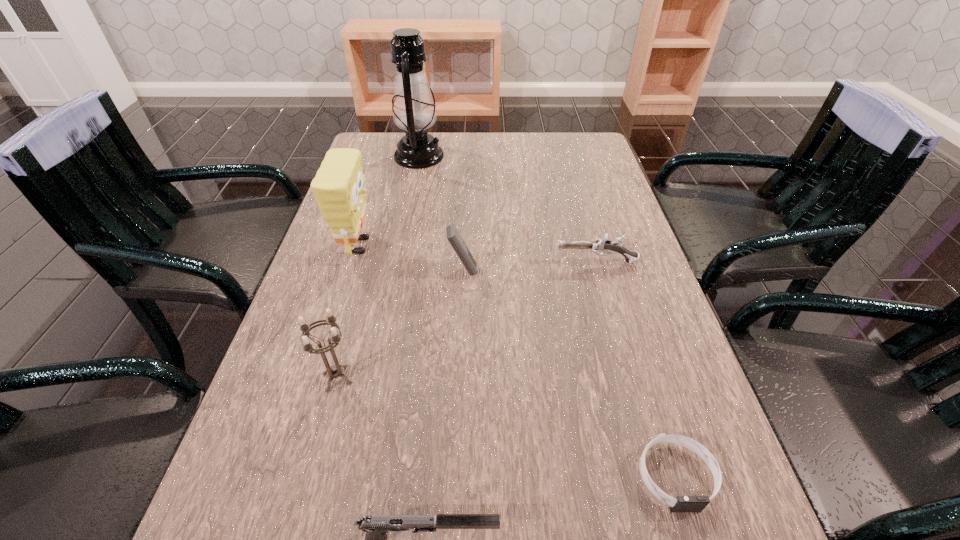
The height and width of the screenshot is (540, 960). I want to click on gun located in the right edge section of the desktop, so click(603, 245).

Image resolution: width=960 pixels, height=540 pixels. I want to click on wristband located in the right edge section of the desktop, so click(x=682, y=503).

I want to click on object that is positioned at the far left corner, so click(413, 108).

The image size is (960, 540). In order to click on vacant space at the far edge of the desktop in this screenshot , I will do `click(465, 152)`.

Where is `vacant region at the left edge of the desktop`? vacant region at the left edge of the desktop is located at coordinates (364, 312).

Identify the location of vacant space at the right edge of the desktop. (646, 377).

Image resolution: width=960 pixels, height=540 pixels. Find the location of `free point at the far left corner`. free point at the far left corner is located at coordinates (365, 153).

At what (x,y) coordinates should I click in order to perform the action: click on unoccupied position between the oil lamp and the fifth farthest object. Please return your answer as a coordinate pair (x, y). The height and width of the screenshot is (540, 960). Looking at the image, I should click on 378,267.

This screenshot has height=540, width=960. In order to click on unoccupied area between the third tallest object and the oil lamp in this screenshot , I will do `click(378, 267)`.

Locate an element on the screen. Image resolution: width=960 pixels, height=540 pixels. vacant area that lies between the wristband and the sponge is located at coordinates (517, 361).